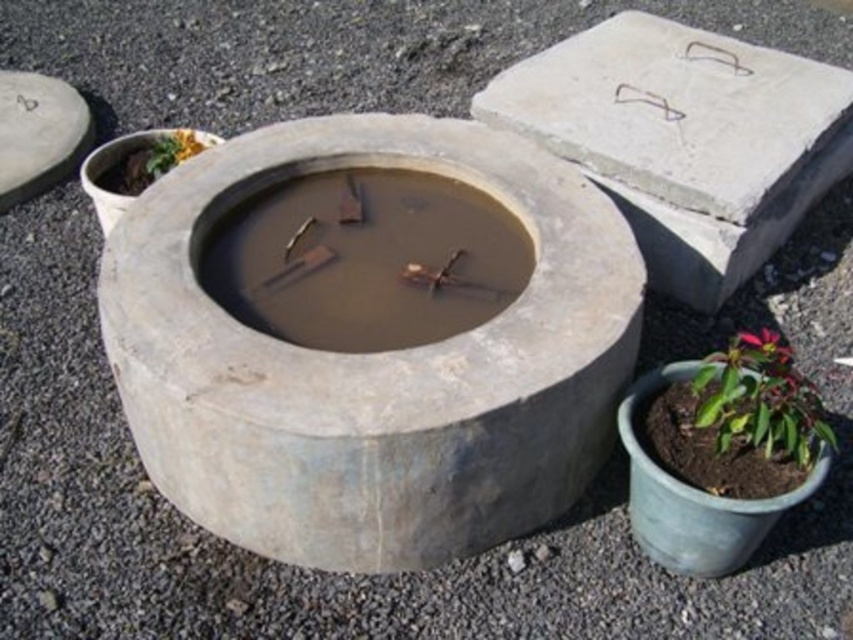
Question: Considering the relative positions of smooth concrete stone at upper left and green leafy plant at upper left in the image provided, where is smooth concrete stone at upper left located with respect to green leafy plant at upper left?

Choices:
 (A) right
 (B) left

Answer: (B)

Question: Is green glossy plant at lower right below green leafy plant at upper left?

Choices:
 (A) no
 (B) yes

Answer: (B)

Question: Which point is farther to the camera?

Choices:
 (A) (735, 115)
 (B) (802, 380)
 (C) (782, 356)
 (D) (479, 342)

Answer: (A)

Question: Which of the following is the farthest from the observer?

Choices:
 (A) (746, 428)
 (B) (488, 499)

Answer: (B)

Question: Where is green glossy plant at lower right located in relation to green leafy plant at lower right in the image?

Choices:
 (A) left
 (B) right

Answer: (A)

Question: Estimate the real-world distances between objects in this image. Which object is closer to the smooth concrete stone at upper left?

Choices:
 (A) green glossy plant at lower right
 (B) green leafy plant at lower right
 (C) smooth concrete slab at upper right
 (D) gray concrete bowl at center

Answer: (D)